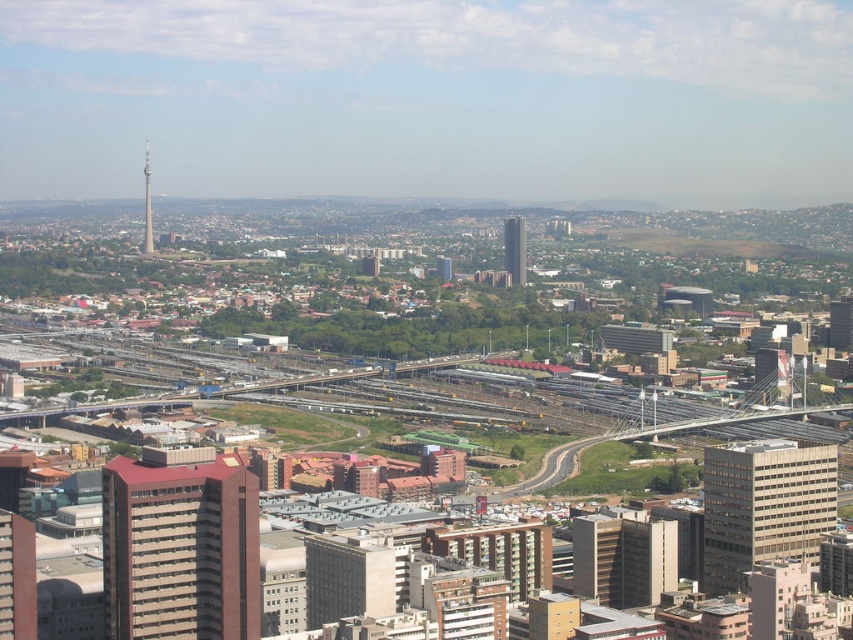
You are a city planner reviewing this urban layout. You need to determine the spatial relationship between the red brick building at center and the beige concrete building at center. Which building is positioned to the left of the other?

The red brick building at center is to the left of the beige concrete building at center.

A drone is flying at the point marked by the coordinate point at point (206, 612). It needs to deliver a package to a location 2000 feet away. Will it be able to reach the destination without exceeding its maximum delivery range of 2000 feet?

The distance between the point marked by the coordinate point (206, 612) and the destination is 2206.71 feet, which exceeds the drone delivery range of 2000 feet. Therefore, the drone cannot reach the destination within its maximum range.